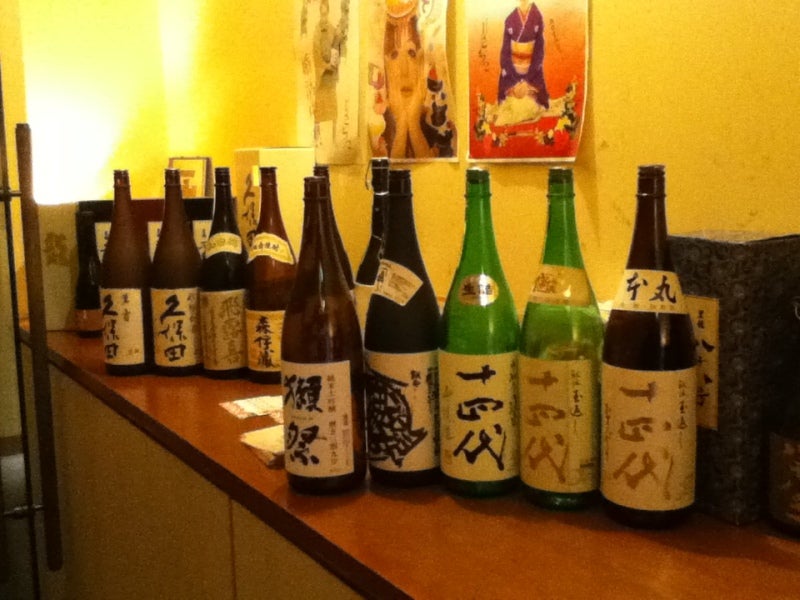
Locate an element on the screen. wood countertop is located at coordinates (194, 433).